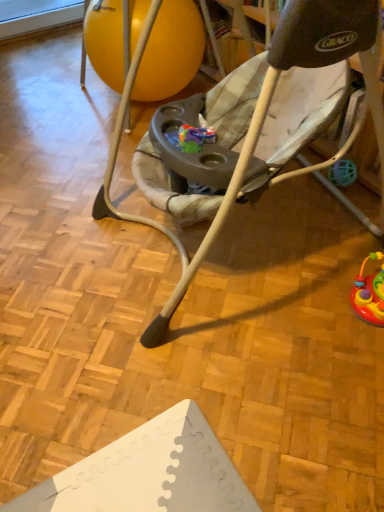
Find the location of a particular element. free space to the left of rubberized yellow ball at center is located at coordinates (50, 120).